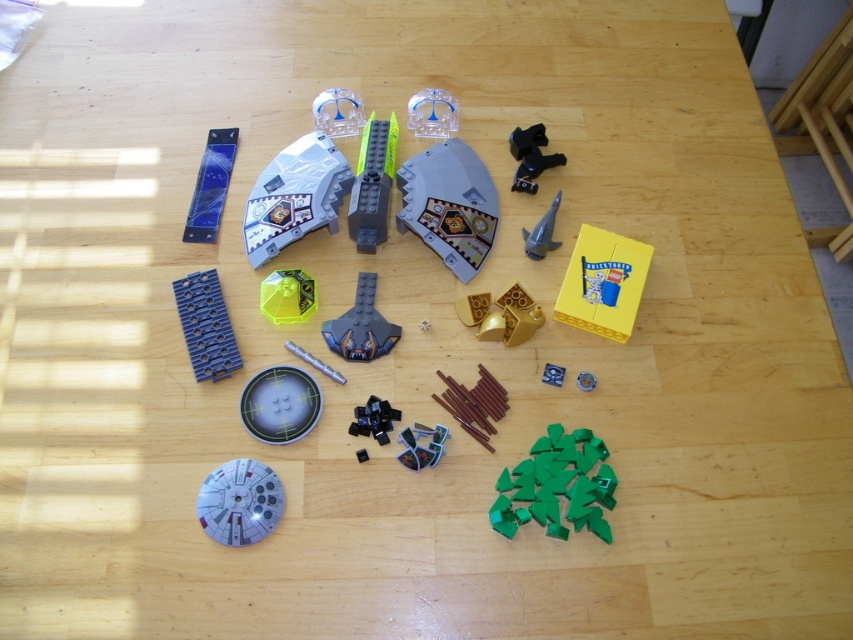
Does point (207, 202) lie behind point (583, 384)?

That is True.

Between point (221, 188) and point (587, 378), which one is positioned behind?

The point (221, 188) is more distant.

Locate an element on the screen. The image size is (853, 640). transparent plastic rectangular block at upper left is located at coordinates (x=210, y=186).

Can you confirm if dark gray plastic at center is thinner than metallic silver gear at lower center?

No, dark gray plastic at center is not thinner than metallic silver gear at lower center.

Between dark gray plastic at center and metallic silver gear at lower center, which one has less height?

metallic silver gear at lower center

Image resolution: width=853 pixels, height=640 pixels. What do you see at coordinates (372, 182) in the screenshot? I see `dark gray plastic at center` at bounding box center [372, 182].

Identify the location of dark gray plastic at center. The width and height of the screenshot is (853, 640). (372, 182).

Who is positioned more to the left, satin silver spaceship at center or transparent blue dome at upper center?

Positioned to the left is transparent blue dome at upper center.

The image size is (853, 640). I want to click on satin silver spaceship at center, so click(x=450, y=204).